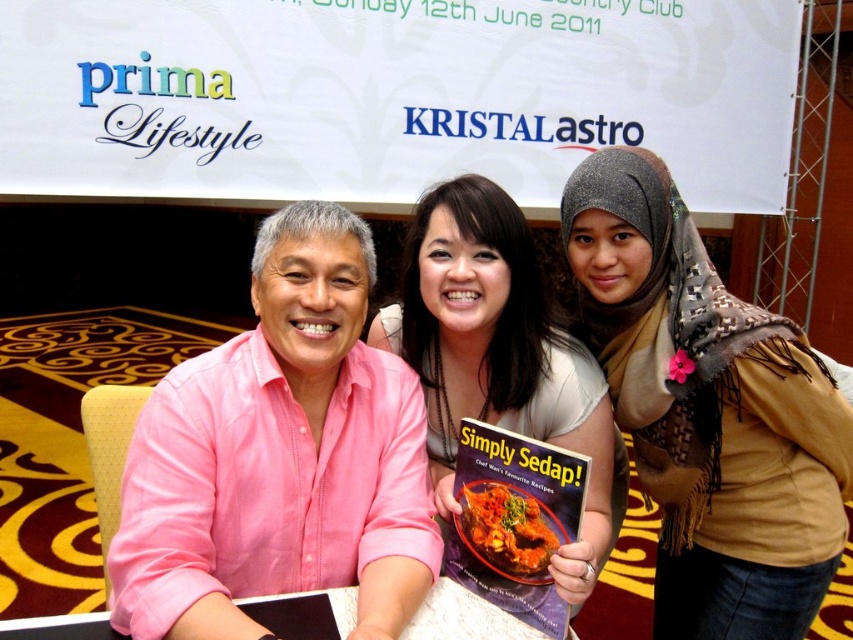
You are a photographer at the event and need to adjust the lighting so that both the pink linen shirt at left and the hardcover book at center are well illuminated. The light source can only be placed on one side. Which side should you place it to ensure both are lit adequately without creating harsh shadows?

The pink linen shirt at left is 9.92 inches away from the hardcover book at center. To ensure both are well illuminated without harsh shadows, place the light source on the side opposite to the objects, so that the light falls evenly on both the pink linen shirt at left and the hardcover book at center.

You are a photographer adjusting your camera settings to focus on two specific points in the image. The first point is at coordinates point (517, 627) and the second is at point (460, 493). Which point should you focus on first if you want to ensure the closest object is in sharp focus?

Point (517, 627) is closer to the camera than point (460, 493), so you should focus on point (517, 627) first to ensure the closest object is in sharp focus.